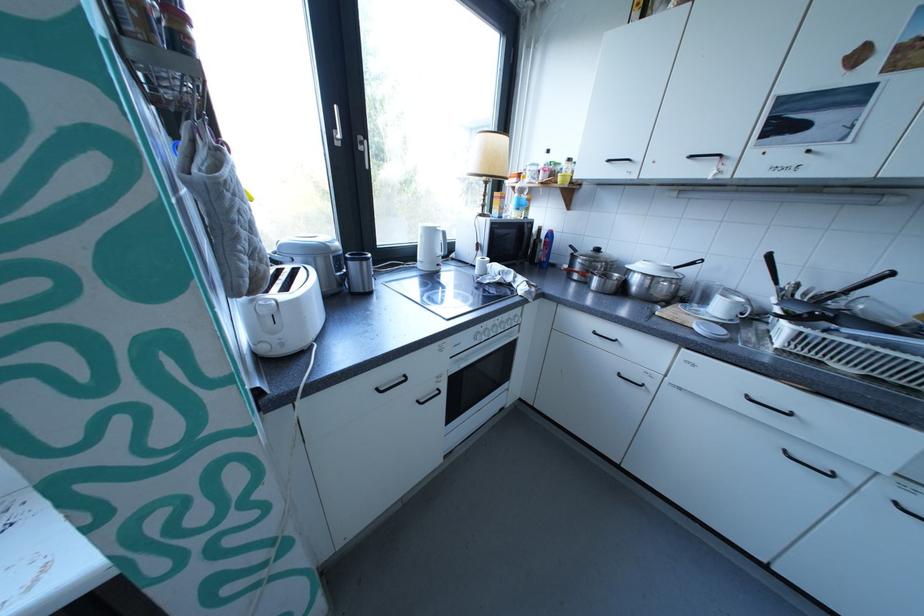
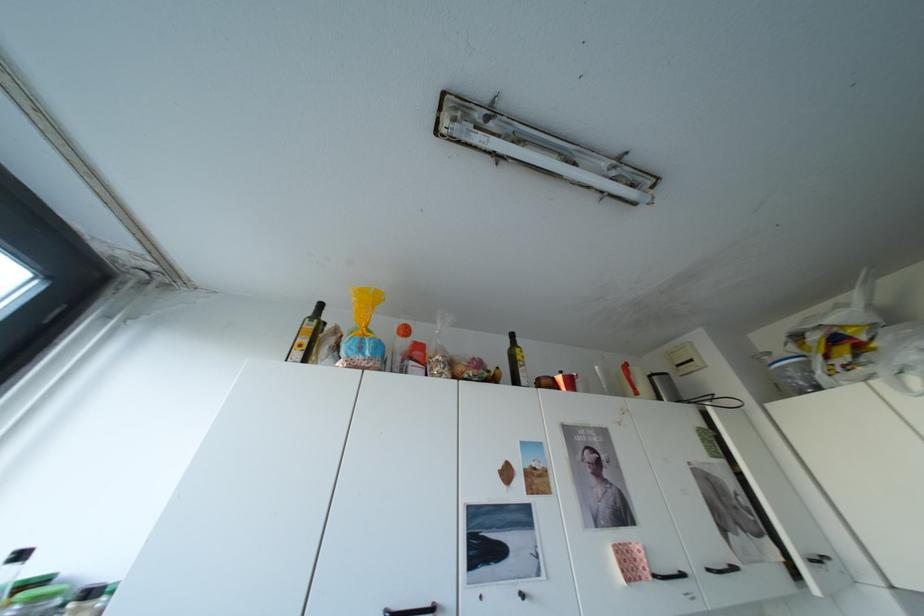
Based on the continuous images, in which direction is the camera rotating?

The rotation direction of the camera is right-up.